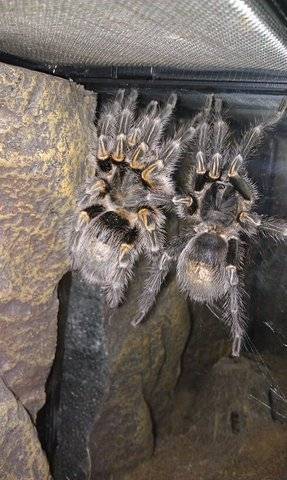
Identify the location of light. (254, 25).